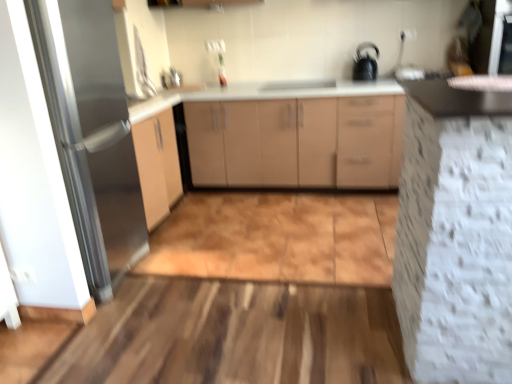
This screenshot has width=512, height=384. Describe the element at coordinates (91, 133) in the screenshot. I see `satin silver fridge at left` at that location.

This screenshot has width=512, height=384. Describe the element at coordinates (455, 234) in the screenshot. I see `white textured cabinet at right, the 1th cabinetry from the front` at that location.

What do you see at coordinates (292, 143) in the screenshot? This screenshot has height=384, width=512. I see `matte beige cabinet at center, positioned as the second cabinetry in front-to-back order` at bounding box center [292, 143].

This screenshot has height=384, width=512. I want to click on matte beige cabinet at center, positioned as the second cabinetry in front-to-back order, so click(292, 143).

This screenshot has height=384, width=512. Identify the location of satin silver fridge at left. (91, 133).

Based on their sizes in the image, would you say black glossy kettle at upper right is bigger or smaller than white textured cabinet at right, which is the second cabinetry in back-to-front order?

In the image, black glossy kettle at upper right appears to be smaller than white textured cabinet at right, which is the second cabinetry in back-to-front order.

Which is correct: black glossy kettle at upper right is inside white textured cabinet at right, the 1th cabinetry from the front, or outside of it?

black glossy kettle at upper right cannot be found inside white textured cabinet at right, the 1th cabinetry from the front.

Considering the sizes of objects black glossy kettle at upper right and white textured cabinet at right, the 1th cabinetry from the front, in the image provided, who is thinner, black glossy kettle at upper right or white textured cabinet at right, the 1th cabinetry from the front,?

Thinner between the two is black glossy kettle at upper right.

Does point (361, 55) come behind point (467, 136)?

Yes.

From a real-world perspective, which object stands above the other?

satin nickel faucet at upper center.

Considering the sizes of objects satin silver fridge at left and satin nickel faucet at upper center in the image provided, who is wider, satin silver fridge at left or satin nickel faucet at upper center?

satin silver fridge at left is wider.

Measure the distance between satin silver fridge at left and satin nickel faucet at upper center.

satin silver fridge at left and satin nickel faucet at upper center are 1.77 meters apart from each other.

Is satin silver fridge at left at the left side of satin nickel faucet at upper center?

Yes, satin silver fridge at left is to the left of satin nickel faucet at upper center.

Where is `appliance in front of the satin nickel faucet at upper center`? appliance in front of the satin nickel faucet at upper center is located at coordinates (365, 63).

Consider the image. Is satin nickel faucet at upper center behind black glossy kettle at upper right?

That is True.

Is satin nickel faucet at upper center aimed at black glossy kettle at upper right?

No, satin nickel faucet at upper center is not turned towards black glossy kettle at upper right.

Is point (174, 68) behind point (373, 58)?

Yes, it is.

Could you tell me if white textured cabinet at right, which is the second cabinetry in back-to-front order, is facing black glossy kettle at upper right?

No, white textured cabinet at right, which is the second cabinetry in back-to-front order, is not facing towards black glossy kettle at upper right.

Which object is further away from the camera taking this photo, white textured cabinet at right, the 1th cabinetry from the front, or black glossy kettle at upper right?

black glossy kettle at upper right is further away from the camera.

Does white textured cabinet at right, the 1th cabinetry from the front, appear on the left side of black glossy kettle at upper right?

Yes, white textured cabinet at right, the 1th cabinetry from the front, is to the left of black glossy kettle at upper right.

Does white textured cabinet at right, which is the second cabinetry in back-to-front order, contain black glossy kettle at upper right?

No, white textured cabinet at right, which is the second cabinetry in back-to-front order, does not contain black glossy kettle at upper right.

From a real-world perspective, which is physically above, satin silver fridge at left or matte beige cabinet at center, positioned as the second cabinetry in front-to-back order?

satin silver fridge at left.

In the scene shown: Is satin silver fridge at left inside the boundaries of matte beige cabinet at center, the 1th cabinetry when ordered from back to front, or outside?

satin silver fridge at left is not inside matte beige cabinet at center, the 1th cabinetry when ordered from back to front, it's outside.

In the image, is satin silver fridge at left positioned in front of or behind matte beige cabinet at center, positioned as the second cabinetry in front-to-back order?

satin silver fridge at left is positioned closer to the viewer than matte beige cabinet at center, positioned as the second cabinetry in front-to-back order.

How distant is satin silver fridge at left from matte beige cabinet at center, the 1th cabinetry when ordered from back to front?

4.50 feet.

Consider the image. Can we say matte beige cabinet at center, the 1th cabinetry when ordered from back to front, lies outside black glossy kettle at upper right?

Absolutely, matte beige cabinet at center, the 1th cabinetry when ordered from back to front, is external to black glossy kettle at upper right.

Considering their positions, is matte beige cabinet at center, positioned as the second cabinetry in front-to-back order, located in front of or behind black glossy kettle at upper right?

In the image, matte beige cabinet at center, positioned as the second cabinetry in front-to-back order, appears in front of black glossy kettle at upper right.

Would you consider matte beige cabinet at center, positioned as the second cabinetry in front-to-back order, to be distant from black glossy kettle at upper right?

No, matte beige cabinet at center, positioned as the second cabinetry in front-to-back order, is not far away from black glossy kettle at upper right.

Is matte beige cabinet at center, positioned as the second cabinetry in front-to-back order, oriented towards satin nickel faucet at upper center?

No, matte beige cabinet at center, positioned as the second cabinetry in front-to-back order, does not turn towards satin nickel faucet at upper center.

Is the depth of matte beige cabinet at center, the 1th cabinetry when ordered from back to front, less than that of satin nickel faucet at upper center?

Yes, matte beige cabinet at center, the 1th cabinetry when ordered from back to front, is closer to the viewer.

From the picture: From a real-world perspective, which is physically below, matte beige cabinet at center, positioned as the second cabinetry in front-to-back order, or satin nickel faucet at upper center?

In real-world perspective, matte beige cabinet at center, positioned as the second cabinetry in front-to-back order, is lower.

Identify the location of appliance that appears above the white textured cabinet at right, the 1th cabinetry from the front (from the image's perspective). (365, 63).

You are a GUI agent. You are given a task and a screenshot of the screen. Output one action in this format:
    pyautogui.click(x=<x>, y=<y>)
    Task: Click on the fridge located in front of the satin nickel faucet at upper center
    
    Given the screenshot: What is the action you would take?
    pyautogui.click(x=91, y=133)

From the image, which object appears to be nearer to matte beige cabinet at center, the 1th cabinetry when ordered from back to front, satin silver fridge at left or white textured cabinet at right, the 1th cabinetry from the front?

Based on the image, satin silver fridge at left appears to be nearer to matte beige cabinet at center, the 1th cabinetry when ordered from back to front.

Considering their positions, is matte beige cabinet at center, positioned as the second cabinetry in front-to-back order, positioned closer to black glossy kettle at upper right than satin nickel faucet at upper center?

matte beige cabinet at center, positioned as the second cabinetry in front-to-back order, lies closer to black glossy kettle at upper right than the other object.

Considering their positions, is white textured cabinet at right, the 1th cabinetry from the front, positioned closer to matte beige cabinet at center, the 1th cabinetry when ordered from back to front, than satin silver fridge at left?

Among the two, satin silver fridge at left is located nearer to matte beige cabinet at center, the 1th cabinetry when ordered from back to front.

Which object lies nearer to the anchor point satin nickel faucet at upper center, matte beige cabinet at center, positioned as the second cabinetry in front-to-back order, or satin silver fridge at left?

The object closer to satin nickel faucet at upper center is matte beige cabinet at center, positioned as the second cabinetry in front-to-back order.

Looking at the image, which one is located further to matte beige cabinet at center, the 1th cabinetry when ordered from back to front, satin nickel faucet at upper center or satin silver fridge at left?

satin silver fridge at left is further to matte beige cabinet at center, the 1th cabinetry when ordered from back to front.

Which object lies further to the anchor point satin nickel faucet at upper center, white textured cabinet at right, which is the second cabinetry in back-to-front order, or satin silver fridge at left?

The object further to satin nickel faucet at upper center is white textured cabinet at right, which is the second cabinetry in back-to-front order.

Based on their spatial positions, is black glossy kettle at upper right or white textured cabinet at right, the 1th cabinetry from the front, closer to satin silver fridge at left?

white textured cabinet at right, the 1th cabinetry from the front, is positioned closer to the anchor satin silver fridge at left.

Looking at the image, which one is located further to black glossy kettle at upper right, white textured cabinet at right, which is the second cabinetry in back-to-front order, or satin silver fridge at left?

satin silver fridge at left is further to black glossy kettle at upper right.

Locate an element on the screen. This screenshot has height=384, width=512. cabinetry between satin silver fridge at left and white textured cabinet at right, the 1th cabinetry from the front, from left to right is located at coordinates (292, 143).

Locate an element on the screen. cabinetry between white textured cabinet at right, which is the second cabinetry in back-to-front order, and black glossy kettle at upper right from front to back is located at coordinates [292, 143].

Locate an element on the screen. fridge positioned between white textured cabinet at right, the 1th cabinetry from the front, and satin nickel faucet at upper center from near to far is located at coordinates (91, 133).

This screenshot has height=384, width=512. I want to click on cabinetry positioned between white textured cabinet at right, the 1th cabinetry from the front, and satin nickel faucet at upper center from near to far, so (x=292, y=143).